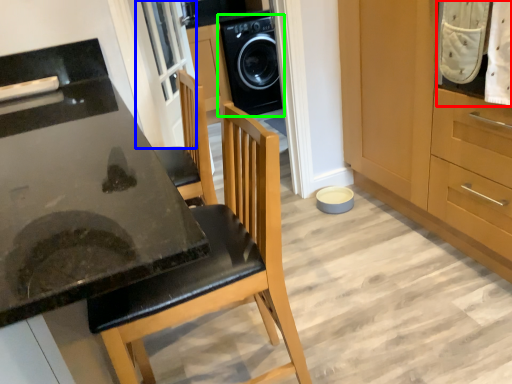
Question: Considering the real-world distances, which object is closest to laundry (highlighted by a red box)? screen door (highlighted by a blue box) or home appliance (highlighted by a green box).

Choices:
 (A) screen door
 (B) home appliance

Answer: (A)